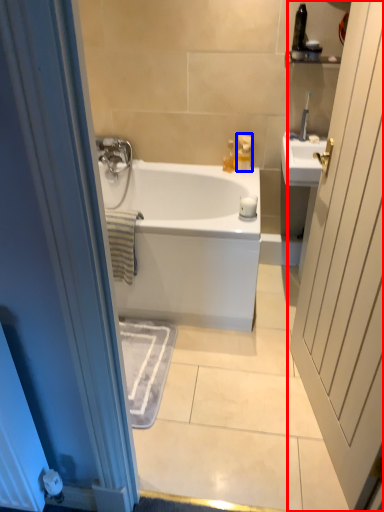
Question: Which of the following is the closest to the observer, door (highlighted by a red box) or toiletry (highlighted by a blue box)?

Choices:
 (A) door
 (B) toiletry

Answer: (A)